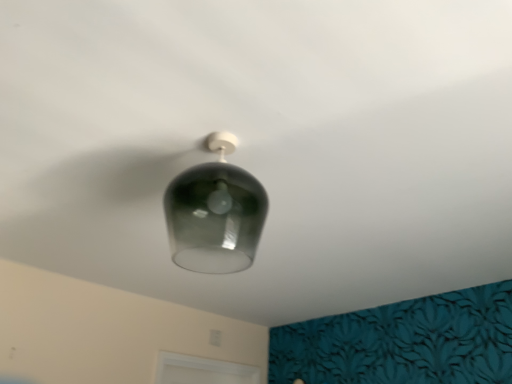
This screenshot has height=384, width=512. Describe the element at coordinates (215, 213) in the screenshot. I see `transparent glass lampshade at upper center` at that location.

What is the approximate width of transparent glass lampshade at upper center?

It is 10.86 inches.

Identify the location of transparent glass lampshade at upper center. Image resolution: width=512 pixels, height=384 pixels. (215, 213).

The width and height of the screenshot is (512, 384). I want to click on transparent glass lampshade at upper center, so click(215, 213).